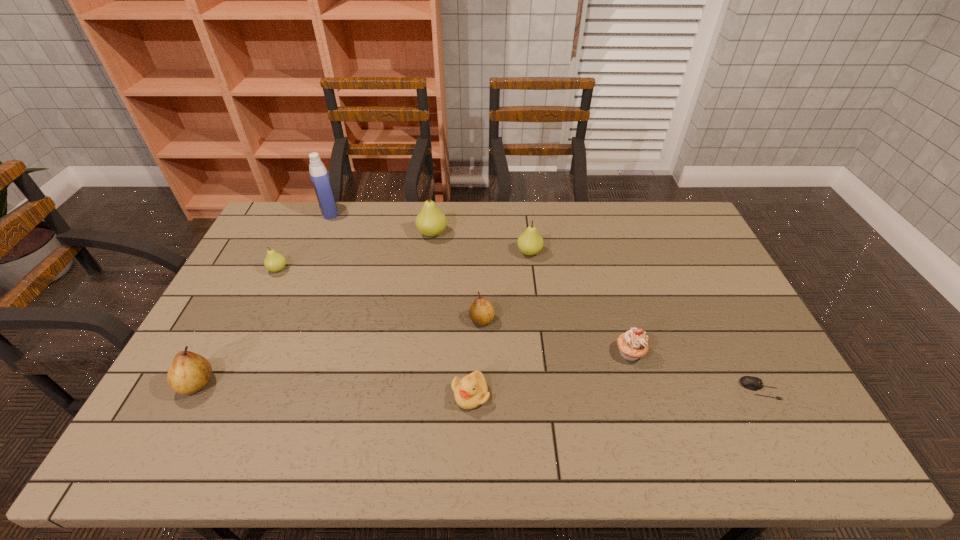
In the image, there is a desktop. Identify the location of free region at the far edge. The height and width of the screenshot is (540, 960). (507, 218).

What are the coordinates of `free location at the near edge of the desktop` in the screenshot? It's located at (666, 450).

Identify the location of free location at the left edge of the desktop. This screenshot has width=960, height=540. (257, 274).

In the image, there is a desktop. What are the coordinates of `vacant space at the right edge` in the screenshot? It's located at (777, 386).

Find the location of a particular element. This screenshot has height=540, width=960. free region at the far right corner of the desktop is located at coordinates (688, 232).

Identify the location of vacant area that lies between the duckling and the cupcake. The width and height of the screenshot is (960, 540). (550, 374).

Locate an element on the screen. free spot between the rightmost pear and the yellow duckling is located at coordinates pyautogui.click(x=500, y=323).

This screenshot has height=540, width=960. I want to click on vacant area between the second object from right to left and the third object from right to left, so click(580, 302).

The image size is (960, 540). In order to click on free area in between the smallest green pear and the duckling in this screenshot , I will do `click(374, 332)`.

Locate an element on the screen. The height and width of the screenshot is (540, 960). vacant region between the farthest object and the farther brown pear is located at coordinates (405, 266).